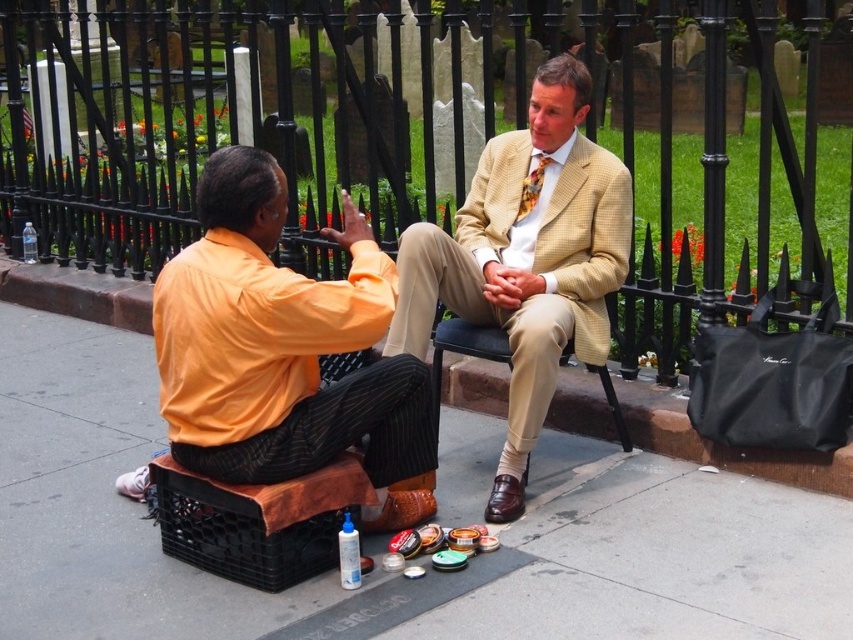
Question: Which point is farther from the camera taking this photo?

Choices:
 (A) (131, 224)
 (B) (296, 284)
 (C) (601, 301)

Answer: (A)

Question: From the image, what is the correct spatial relationship of black wrought iron fence at upper center in relation to orange shirt at left?

Choices:
 (A) right
 (B) left

Answer: (B)

Question: Where is orange shirt at left located in relation to floral silk tie at center in the image?

Choices:
 (A) below
 (B) above

Answer: (A)

Question: Is orange shirt at left bigger than floral silk tie at center?

Choices:
 (A) yes
 (B) no

Answer: (A)

Question: Which object appears farthest from the camera in this image?

Choices:
 (A) floral silk tie at center
 (B) light beige textured suit at center
 (C) brown leather shoe at lower center
 (D) black wrought iron fence at upper center

Answer: (D)

Question: Which point is closer to the camera taking this photo?

Choices:
 (A) (595, 129)
 (B) (527, 204)
 (C) (502, 499)
 (D) (358, 422)

Answer: (D)